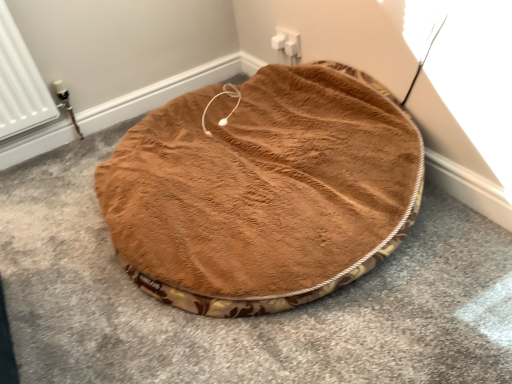
Question: From the image's perspective, would you say brown plush dog bed at center is shown under white plastic electric outlet at upper center?

Choices:
 (A) no
 (B) yes

Answer: (B)

Question: Does brown plush dog bed at center have a smaller size compared to white plastic electric outlet at upper center?

Choices:
 (A) yes
 (B) no

Answer: (B)

Question: Is brown plush dog bed at center taller than white plastic electric outlet at upper center?

Choices:
 (A) yes
 (B) no

Answer: (A)

Question: Is brown plush dog bed at center further to camera compared to white plastic electric outlet at upper center?

Choices:
 (A) yes
 (B) no

Answer: (B)

Question: Is brown plush dog bed at center surrounding white plastic electric outlet at upper center?

Choices:
 (A) yes
 (B) no

Answer: (B)

Question: Is brown plush dog bed at center oriented towards white plastic electric outlet at upper center?

Choices:
 (A) no
 (B) yes

Answer: (A)

Question: Can you confirm if white plastic electric outlet at upper center is shorter than brown plush dog bed at center?

Choices:
 (A) yes
 (B) no

Answer: (A)

Question: From the image's perspective, is white plastic electric outlet at upper center located above brown plush dog bed at center?

Choices:
 (A) yes
 (B) no

Answer: (A)

Question: Is the depth of white plastic electric outlet at upper center greater than that of brown plush dog bed at center?

Choices:
 (A) yes
 (B) no

Answer: (A)

Question: Are white plastic electric outlet at upper center and brown plush dog bed at center making contact?

Choices:
 (A) no
 (B) yes

Answer: (A)

Question: Would you say white plastic electric outlet at upper center is a long distance from brown plush dog bed at center?

Choices:
 (A) no
 (B) yes

Answer: (A)

Question: From the image's perspective, is white plastic electric outlet at upper center located beneath brown plush dog bed at center?

Choices:
 (A) no
 (B) yes

Answer: (A)

Question: Is brown plush dog bed at center inside the boundaries of white plastic electric outlet at upper center, or outside?

Choices:
 (A) outside
 (B) inside

Answer: (A)